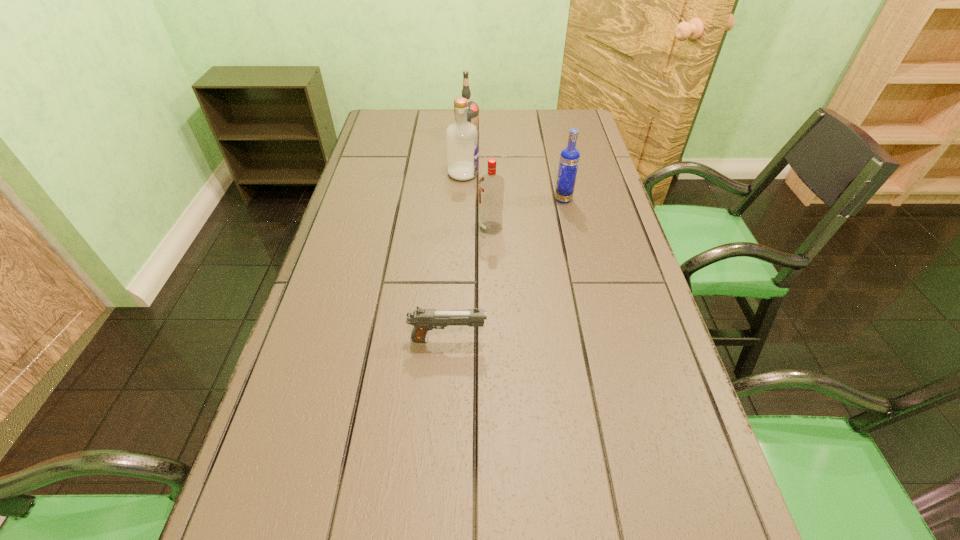
The width and height of the screenshot is (960, 540). Identify the location of free space located 0.230m on the front label of the fourth farthest object. (394, 228).

You are a GUI agent. You are given a task and a screenshot of the screen. Output one action in this format:
    pyautogui.click(x=<x>, y=<y>)
    Task: Click on the vacant region located on the front label of the fourth farthest object
    The width and height of the screenshot is (960, 540).
    Given the screenshot: What is the action you would take?
    pyautogui.click(x=394, y=228)

At what (x,y) coordinates should I click in order to perform the action: click on free space located 0.280m on the front label of the fourth farthest object. Please return your answer as a coordinate pair (x, y). Looking at the image, I should click on (375, 228).

The image size is (960, 540). Find the location of `vacant space situated 0.280m in the direction the shortest object is aimed`. vacant space situated 0.280m in the direction the shortest object is aimed is located at coordinates (617, 340).

Where is `object located at the far edge`? Image resolution: width=960 pixels, height=540 pixels. object located at the far edge is located at coordinates (473, 109).

The width and height of the screenshot is (960, 540). I want to click on object situated at the right edge, so click(569, 159).

In the image, there is a desktop. Where is `vacant space at the far edge`? vacant space at the far edge is located at coordinates (492, 123).

Locate an element on the screen. The image size is (960, 540). vacant space at the left edge is located at coordinates (362, 237).

Identify the location of vacant point at the right edge. (617, 336).

Where is `free space between the rightmost vodka and the gun`? The height and width of the screenshot is (540, 960). free space between the rightmost vodka and the gun is located at coordinates (506, 269).